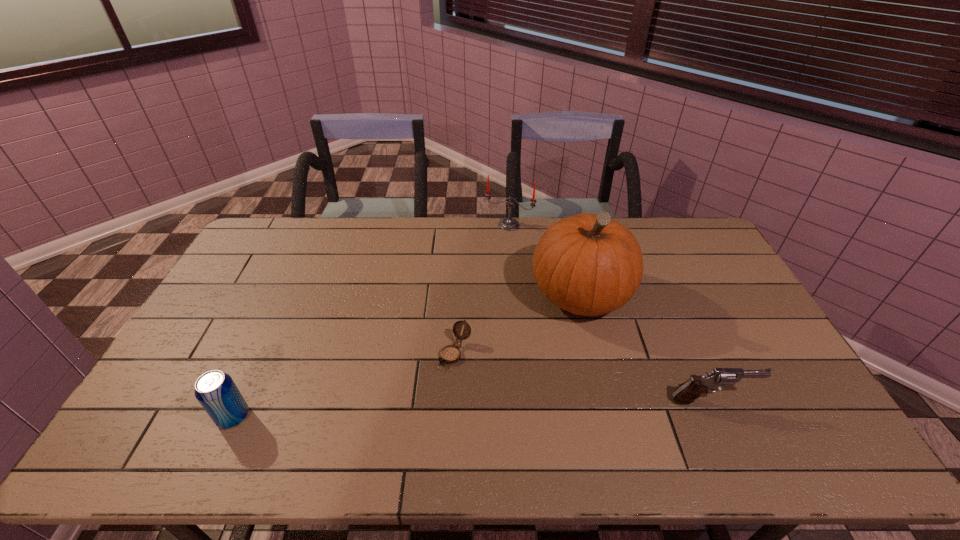
Where is `free space on the desktop that is between the leftmost object and the rightmost object and is positioned on the front-facing side of the fourth shortest object`? free space on the desktop that is between the leftmost object and the rightmost object and is positioned on the front-facing side of the fourth shortest object is located at coordinates (428, 410).

Where is `vacant space on the desktop that is between the beer can and the pistol and is positioned on the stem of the pumpkin`? vacant space on the desktop that is between the beer can and the pistol and is positioned on the stem of the pumpkin is located at coordinates (467, 409).

Identify the location of vacant spot on the desktop that is between the leftmost object and the pistol and is positioned on the face of the shortest object. The width and height of the screenshot is (960, 540). (409, 411).